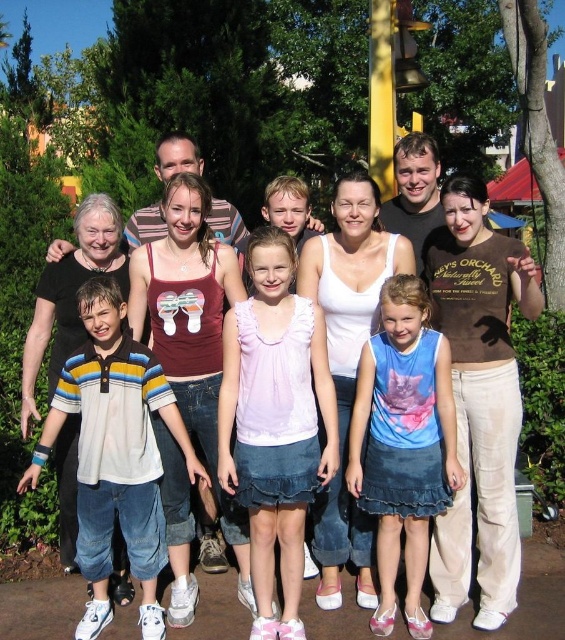
Does striped cotton shirt at left come in front of white cotton tank top at center?

Yes, striped cotton shirt at left is in front of white cotton tank top at center.

Does striped cotton shirt at left appear on the left side of white cotton tank top at center?

No, striped cotton shirt at left is not to the left of white cotton tank top at center.

Does point (151, 609) come closer to viewer compared to point (184, 216)?

Yes, it is.

Find the location of a particular element. The height and width of the screenshot is (640, 565). striped cotton shirt at left is located at coordinates coord(115,454).

From the picture: Can you confirm if white cotton tank top at center is thinner than blue denim skirt at center?

No.

Is white cotton tank top at center above blue denim skirt at center?

Correct, white cotton tank top at center is located above blue denim skirt at center.

Who is more distant from viewer, (49, 326) or (415, 348)?

Point (49, 326)

Where is `white cotton tank top at center`? This screenshot has width=565, height=640. white cotton tank top at center is located at coordinates (69, 292).

Does pink satin blouse at center have a smaller size compared to white cotton tank top at center?

No, pink satin blouse at center is not smaller than white cotton tank top at center.

Which is behind, point (241, 445) or point (67, 426)?

The point (67, 426) is behind.

Find the location of a particular element. pink satin blouse at center is located at coordinates (275, 420).